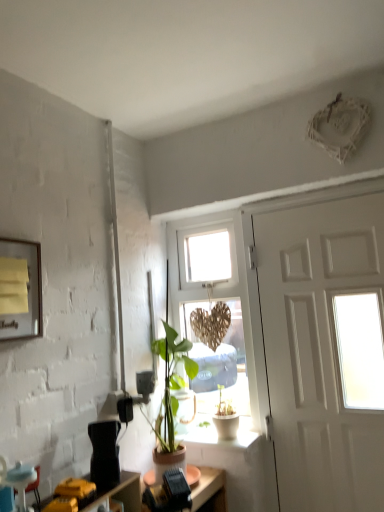
What do you see at coordinates (319, 350) in the screenshot? I see `white matte door at right` at bounding box center [319, 350].

In order to face white matte door at right, should I rotate leftwards or rightwards?

To face it directly, rotate right by 18.024 degrees.

What do you see at coordinates (28, 292) in the screenshot? This screenshot has width=384, height=512. I see `yellow paper at upper left` at bounding box center [28, 292].

Find the location of a particular element. black plastic desk at lower center is located at coordinates (207, 485).

The height and width of the screenshot is (512, 384). I want to click on blue fabric armchair at lower left, so click(x=21, y=481).

Where is `white ceramic pot at lower center`? The height and width of the screenshot is (512, 384). white ceramic pot at lower center is located at coordinates (215, 434).

Considering the relative positions of white matte door at right and black plastic desk at lower center in the image provided, is white matte door at right to the left of black plastic desk at lower center from the viewer's perspective?

No.

Considering the points (298, 407) and (201, 478), which point is behind, point (298, 407) or point (201, 478)?

Positioned behind is point (298, 407).

Between white matte door at right and black plastic desk at lower center, which one has less height?

With less height is black plastic desk at lower center.

Is there a large distance between white matte door at right and black plastic desk at lower center?

No, there isn't a large distance between white matte door at right and black plastic desk at lower center.

How different are the orientations of wooden heart at center and blue fabric armchair at lower left in degrees?

The angular difference between wooden heart at center and blue fabric armchair at lower left is 89.8 degrees.

Looking at the image, does wooden heart at center seem bigger or smaller compared to blue fabric armchair at lower left?

Clearly, wooden heart at center is larger in size than blue fabric armchair at lower left.

From the image's perspective, which one is positioned higher, wooden heart at center or blue fabric armchair at lower left?

wooden heart at center.

From a real-world perspective, does wooden heart at center sit lower than blue fabric armchair at lower left?

No.

Image resolution: width=384 pixels, height=512 pixels. What are the coordinates of `armchair above the white ceramic pot at lower center (from the image's perspective)` in the screenshot? It's located at (21, 481).

Based on the photo, from the image's perspective, is blue fabric armchair at lower left above or below white ceramic pot at lower center?

blue fabric armchair at lower left is situated higher than white ceramic pot at lower center in the image.

Does point (29, 466) come farther from viewer compared to point (205, 426)?

That is False.

Can you confirm if yellow paper at upper left is taller than white ceramic pot at lower center?

Correct, yellow paper at upper left is much taller as white ceramic pot at lower center.

Considering the positions of points (36, 329) and (205, 442), is point (36, 329) closer to camera compared to point (205, 442)?

Yes, point (36, 329) is closer to viewer.

Is yellow paper at upper left directly adjacent to white ceramic pot at lower center?

No, yellow paper at upper left is not with white ceramic pot at lower center.

Which object is closer to the camera taking this photo, yellow paper at upper left or white ceramic pot at lower center?

yellow paper at upper left.

Considering the relative sizes of yellow paper at upper left and wooden heart at center in the image provided, is yellow paper at upper left thinner than wooden heart at center?

Yes, yellow paper at upper left is thinner than wooden heart at center.

Is yellow paper at upper left far from wooden heart at center?

No, yellow paper at upper left is not far from wooden heart at center.

This screenshot has height=512, width=384. I want to click on window that appears on the right of yellow paper at upper left, so click(x=223, y=295).

What's the angular difference between yellow paper at upper left and wooden heart at center's facing directions?

90.6 degrees.

From the picture: From a real-world perspective, relative to black plastic desk at lower center, is blue fabric armchair at lower left vertically above or below?

In terms of real-world spatial position, blue fabric armchair at lower left is above black plastic desk at lower center.

You are a GUI agent. You are given a task and a screenshot of the screen. Output one action in this format:
    pyautogui.click(x=<x>, y=<y>)
    Task: Click on the desk behind the blue fabric armchair at lower left
    
    Given the screenshot: What is the action you would take?
    pyautogui.click(x=207, y=485)

Considering the points (23, 508) and (198, 488), which point is behind, point (23, 508) or point (198, 488)?

Point (198, 488)

What's the angular difference between blue fabric armchair at lower left and black plastic desk at lower center's facing directions?

32.2 degrees.

Which of these two, wooden heart at center or white matte door at right, is thinner?

Thinner between the two is white matte door at right.

From a real-world perspective, between wooden heart at center and white matte door at right, who is vertically lower?

white matte door at right, from a real-world perspective.

Who is more distant, wooden heart at center or white matte door at right?

wooden heart at center is behind.

Locate an element on the screen. The height and width of the screenshot is (512, 384). window above the white matte door at right (from the image's perspective) is located at coordinates (223, 295).

The image size is (384, 512). I want to click on door behind the black plastic desk at lower center, so 319,350.

Where is `armchair on the left of wooden heart at center`? The width and height of the screenshot is (384, 512). armchair on the left of wooden heart at center is located at coordinates (21, 481).

Looking at the image, which one is located further to white ceramic pot at lower center, blue fabric armchair at lower left or white matte door at right?

blue fabric armchair at lower left is positioned further to the anchor white ceramic pot at lower center.

From the image, which object appears to be nearer to wooden heart at center, black plastic desk at lower center or blue fabric armchair at lower left?

The object closer to wooden heart at center is black plastic desk at lower center.

When comparing their distances from blue fabric armchair at lower left, does yellow paper at upper left or black plastic desk at lower center seem closer?

Among the two, yellow paper at upper left is located nearer to blue fabric armchair at lower left.

Estimate the real-world distances between objects in this image. Which object is closer to wooden heart at center, white ceramic pot at lower center or black plastic desk at lower center?

Among the two, white ceramic pot at lower center is located nearer to wooden heart at center.

Based on their spatial positions, is white ceramic pot at lower center or white matte door at right closer to yellow paper at upper left?

The object closer to yellow paper at upper left is white ceramic pot at lower center.

Based on their spatial positions, is blue fabric armchair at lower left or wooden heart at center further from black plastic desk at lower center?

blue fabric armchair at lower left lies further to black plastic desk at lower center than the other object.

Which object lies nearer to the anchor point black plastic desk at lower center, yellow paper at upper left or white ceramic pot at lower center?

white ceramic pot at lower center lies closer to black plastic desk at lower center than the other object.

When comparing their distances from yellow paper at upper left, does wooden heart at center or white matte door at right seem further?

The object further to yellow paper at upper left is white matte door at right.

Identify the location of desk situated between yellow paper at upper left and white matte door at right from left to right. Image resolution: width=384 pixels, height=512 pixels. (207, 485).

Identify the location of armchair between yellow paper at upper left and white ceramic pot at lower center vertically. (21, 481).

This screenshot has height=512, width=384. What are the coordinates of `armchair that lies between yellow paper at upper left and black plastic desk at lower center from top to bottom` in the screenshot? It's located at (21, 481).

The height and width of the screenshot is (512, 384). Identify the location of window sill between black plastic desk at lower center and white matte door at right from left to right. (215, 434).